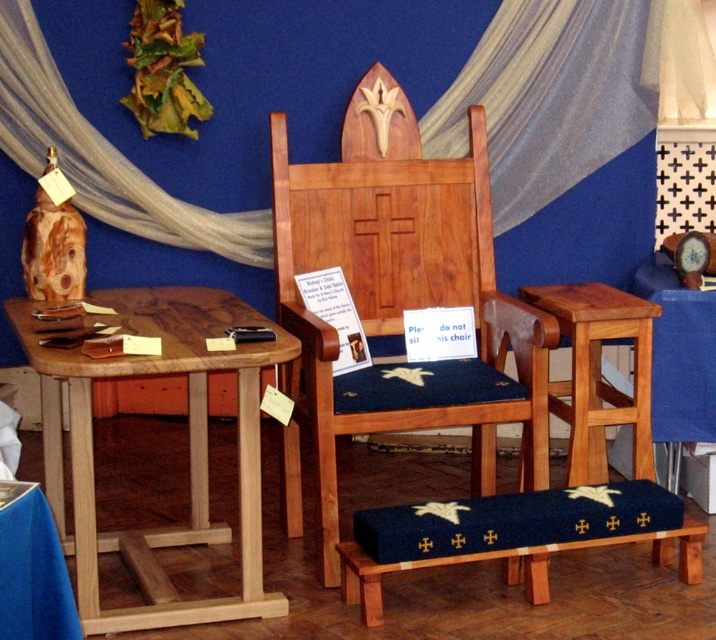
Question: Does wooden chair at center appear over wooden table at right?

Choices:
 (A) no
 (B) yes

Answer: (B)

Question: Considering the relative positions of natural wood table at left and white sheer fabric at upper left in the image provided, where is natural wood table at left located with respect to white sheer fabric at upper left?

Choices:
 (A) below
 (B) above

Answer: (A)

Question: Which point is farther to the camera?

Choices:
 (A) natural wood table at left
 (B) white sheer fabric at upper left

Answer: (B)

Question: Which object is the closest to the wooden table at right?

Choices:
 (A) wooden chair at center
 (B) white sheer fabric at upper left
 (C) natural wood table at left
 (D) blue fabric tablecloth at lower left

Answer: (A)

Question: Does wooden chair at center come in front of blue fabric tablecloth at lower left?

Choices:
 (A) yes
 (B) no

Answer: (B)

Question: Which object is positioned farthest from the blue fabric tablecloth at lower left?

Choices:
 (A) wooden table at right
 (B) wooden chair at center
 (C) natural wood table at left
 (D) white sheer fabric at upper left

Answer: (D)